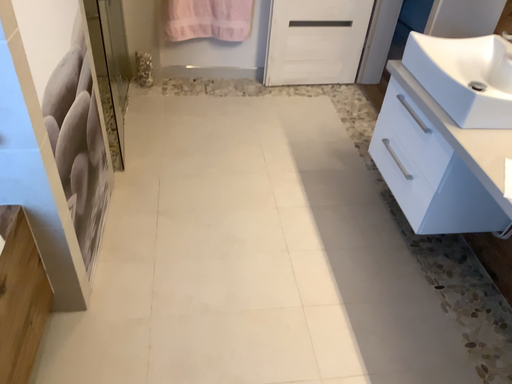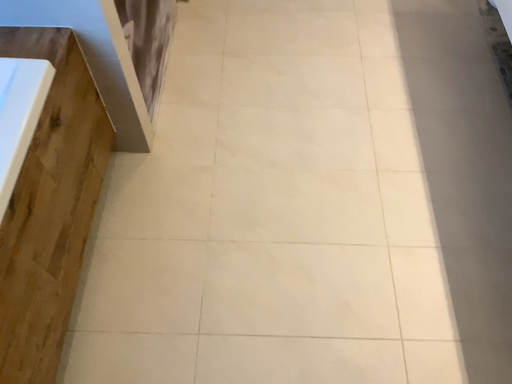
Question: Which way did the camera rotate in the video?

Choices:
 (A) rotated upward
 (B) rotated downward

Answer: (B)